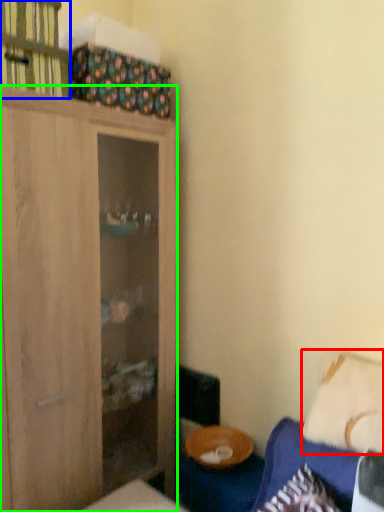
Question: Which object is positioned closest to pillow (highlighted by a red box)? Select from cabinet (highlighted by a blue box) and cabinetry (highlighted by a green box).

Choices:
 (A) cabinet
 (B) cabinetry

Answer: (B)